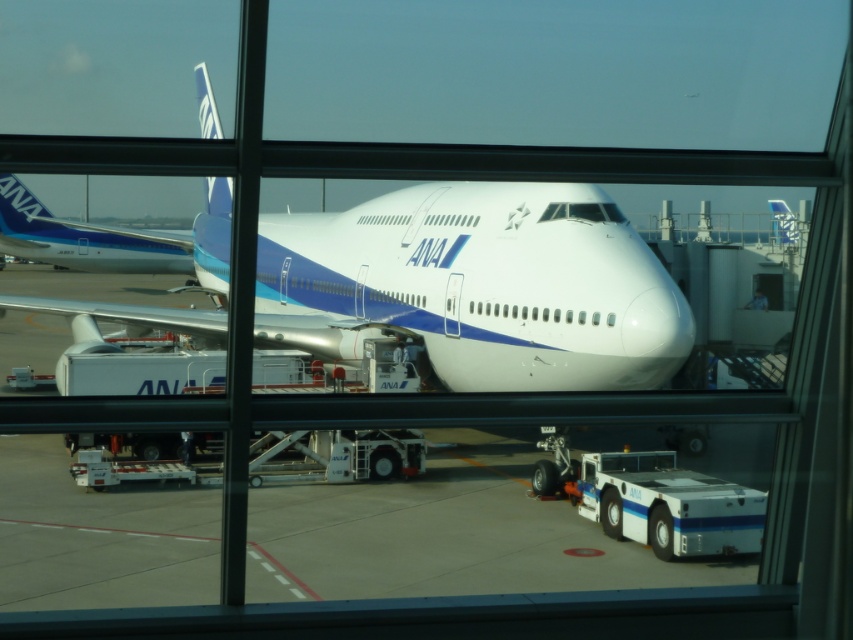
Question: Which object is farther from the camera taking this photo?

Choices:
 (A) matte blue airplane at left
 (B) white glossy airplane at center

Answer: (A)

Question: Is white glossy airplane at center wider than matte blue airplane at left?

Choices:
 (A) yes
 (B) no

Answer: (A)

Question: Which point appears farthest from the camera in this image?

Choices:
 (A) (45, 211)
 (B) (471, 362)

Answer: (A)

Question: Can you confirm if white glossy airplane at center is wider than matte blue airplane at left?

Choices:
 (A) yes
 (B) no

Answer: (A)

Question: Which of the following is the closest to the observer?

Choices:
 (A) (186, 310)
 (B) (21, 228)

Answer: (A)

Question: Can you confirm if white glossy airplane at center is positioned below matte blue airplane at left?

Choices:
 (A) yes
 (B) no

Answer: (A)